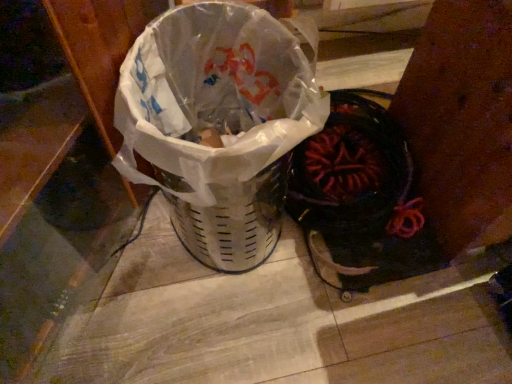
Locate an element on the screen. This screenshot has height=384, width=512. rubberized black shoe at lower right is located at coordinates (360, 198).

Describe the element at coordinates (360, 198) in the screenshot. This screenshot has width=512, height=384. I see `rubberized black shoe at lower right` at that location.

Find the location of `rubberized black shoe at lower right`. rubberized black shoe at lower right is located at coordinates (360, 198).